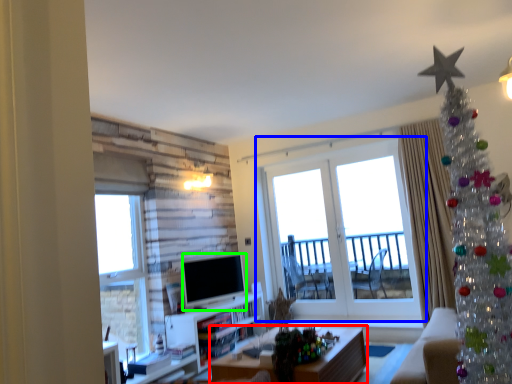
Question: Which is nearer to the desk (highlighted by a red box)? window (highlighted by a blue box) or television (highlighted by a green box).

Choices:
 (A) window
 (B) television

Answer: (B)